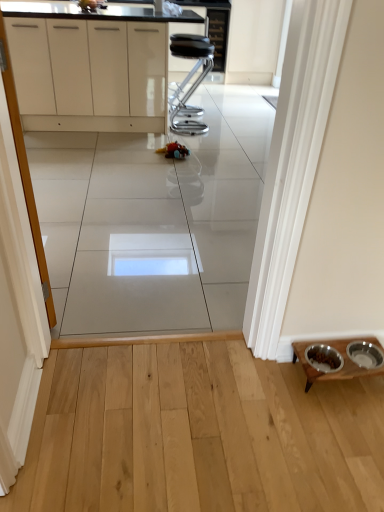
From the picture: What is the approximate height of plush multicolored toy at center?

It is 4.82 inches.

Measure the distance between white glossy cabinet at left and camera.

34.57 inches.

Where is `black leather stool at center`? This screenshot has height=512, width=384. black leather stool at center is located at coordinates (188, 81).

The width and height of the screenshot is (384, 512). What do you see at coordinates (88, 66) in the screenshot? I see `white glossy cabinets at upper center` at bounding box center [88, 66].

Locate an element on the screen. This screenshot has height=512, width=384. plush multicolored toy at center is located at coordinates (174, 150).

From the image's perspective, which one is positioned lower, wooden table at lower right or plush multicolored toy at center?

wooden table at lower right appears lower in the image.

Considering the relative positions of wooden table at lower right and plush multicolored toy at center in the image provided, is wooden table at lower right to the right of plush multicolored toy at center from the viewer's perspective?

Indeed, wooden table at lower right is positioned on the right side of plush multicolored toy at center.

Locate an element on the screen. toy below the wooden table at lower right (from a real-world perspective) is located at coordinates (174, 150).

Measure the distance between wooden table at lower right and plush multicolored toy at center.

They are 2.13 meters apart.

In terms of size, does white glossy cabinets at upper center appear bigger or smaller than black leather stool at center?

Clearly, white glossy cabinets at upper center is larger in size than black leather stool at center.

From the image's perspective, which is below, white glossy cabinets at upper center or black leather stool at center?

black leather stool at center, from the image's perspective.

Does white glossy cabinets at upper center come behind black leather stool at center?

No.

Is plush multicolored toy at center positioned beyond the bounds of white glossy cabinets at upper center?

Yes, plush multicolored toy at center is outside of white glossy cabinets at upper center.

In the scene shown: Relative to white glossy cabinets at upper center, is plush multicolored toy at center in front or behind?

plush multicolored toy at center is behind white glossy cabinets at upper center.

Can you confirm if plush multicolored toy at center is bigger than white glossy cabinets at upper center?

Incorrect, plush multicolored toy at center is not larger than white glossy cabinets at upper center.

Would you say plush multicolored toy at center is a long distance from white glossy cabinets at upper center?

No, there isn't a large distance between plush multicolored toy at center and white glossy cabinets at upper center.

Based on the photo, how much distance is there between wooden table at lower right and white glossy cabinets at upper center?

wooden table at lower right is 9.42 feet from white glossy cabinets at upper center.

Would you say wooden table at lower right is to the left or to the right of white glossy cabinets at upper center in the picture?

wooden table at lower right is positioned on white glossy cabinets at upper center's right side.

From a real-world perspective, relative to white glossy cabinets at upper center, is wooden table at lower right vertically above or below?

From a real-world perspective, wooden table at lower right is physically below white glossy cabinets at upper center.

Is wooden table at lower right positioned behind white glossy cabinets at upper center?

No, wooden table at lower right is closer to the camera.

Based on the photo, are white glossy cabinets at upper center and white glossy cabinet at left far apart?

white glossy cabinets at upper center is positioned a significant distance from white glossy cabinet at left.

From a real-world perspective, is white glossy cabinets at upper center under white glossy cabinet at left?

Yes, from a real-world perspective, white glossy cabinets at upper center is under white glossy cabinet at left.

Could you tell me if white glossy cabinets at upper center is facing white glossy cabinet at left?

No, white glossy cabinets at upper center is not turned towards white glossy cabinet at left.

Is white glossy cabinets at upper center behind white glossy cabinet at left?

Yes, white glossy cabinets at upper center is behind white glossy cabinet at left.

Can we say wooden table at lower right lies outside black leather stool at center?

Indeed, wooden table at lower right is completely outside black leather stool at center.

From the picture: From the image's perspective, would you say wooden table at lower right is positioned over black leather stool at center?

No, from the image's perspective, wooden table at lower right is not over black leather stool at center.

From a real-world perspective, does wooden table at lower right sit lower than black leather stool at center?

Yes.

Which is more to the left, wooden table at lower right or black leather stool at center?

black leather stool at center is more to the left.

Which object is positioned more to the left, black leather stool at center or white glossy cabinet at left?

From the viewer's perspective, white glossy cabinet at left appears more on the left side.

Which point is more forward, (194, 108) or (44, 293)?

The point (44, 293) is closer to the camera.

Who is shorter, black leather stool at center or white glossy cabinet at left?

Standing shorter between the two is black leather stool at center.

Would you say black leather stool at center contains white glossy cabinet at left?

No, black leather stool at center does not contain white glossy cabinet at left.

Where is `toy above the wooden table at lower right (from the image's perspective)`? Image resolution: width=384 pixels, height=512 pixels. toy above the wooden table at lower right (from the image's perspective) is located at coordinates coord(174,150).

Where is `cabinetry on the left side of black leather stool at center`? The width and height of the screenshot is (384, 512). cabinetry on the left side of black leather stool at center is located at coordinates (88, 66).

Estimate the real-world distances between objects in this image. Which object is closer to wooden table at lower right, black leather stool at center or plush multicolored toy at center?

The object closer to wooden table at lower right is plush multicolored toy at center.

Considering their positions, is black leather stool at center positioned further to white glossy cabinet at left than plush multicolored toy at center?

black leather stool at center is further to white glossy cabinet at left.

Which object lies nearer to the anchor point white glossy cabinets at upper center, white glossy cabinet at left or plush multicolored toy at center?

plush multicolored toy at center lies closer to white glossy cabinets at upper center than the other object.

When comparing their distances from white glossy cabinet at left, does wooden table at lower right or white glossy cabinets at upper center seem closer?

wooden table at lower right is closer to white glossy cabinet at left.

Considering their positions, is white glossy cabinets at upper center positioned closer to wooden table at lower right than white glossy cabinet at left?

white glossy cabinet at left is closer to wooden table at lower right.

From the image, which object appears to be farther from black leather stool at center, wooden table at lower right or white glossy cabinets at upper center?

wooden table at lower right lies further to black leather stool at center than the other object.

Estimate the real-world distances between objects in this image. Which object is further from black leather stool at center, white glossy cabinet at left or white glossy cabinets at upper center?

Based on the image, white glossy cabinet at left appears to be further to black leather stool at center.

Looking at the image, which one is located further to white glossy cabinets at upper center, wooden table at lower right or black leather stool at center?

wooden table at lower right is positioned further to the anchor white glossy cabinets at upper center.

At what (x,y) coordinates should I click in order to perform the action: click on toy situated between white glossy cabinets at upper center and black leather stool at center from left to right. Please return your answer as a coordinate pair (x, y). This screenshot has width=384, height=512. Looking at the image, I should click on (174, 150).

This screenshot has height=512, width=384. In order to click on cabinetry between white glossy cabinet at left and black leather stool at center in the front-back direction in this screenshot , I will do `click(88, 66)`.

You are a GUI agent. You are given a task and a screenshot of the screen. Output one action in this format:
    pyautogui.click(x=<x>, y=<y>)
    Task: Click on the table between white glossy cabinet at left and white glossy cabinets at upper center in the front-back direction
    
    Given the screenshot: What is the action you would take?
    pos(330,372)

The width and height of the screenshot is (384, 512). Identify the location of toy between wooden table at lower right and black leather stool at center along the z-axis. (174, 150).